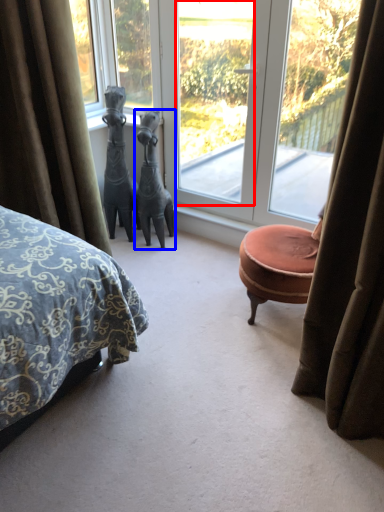
Question: Which of the following is the closest to the observer, window screen (highlighted by a red box) or animal (highlighted by a blue box)?

Choices:
 (A) window screen
 (B) animal

Answer: (A)